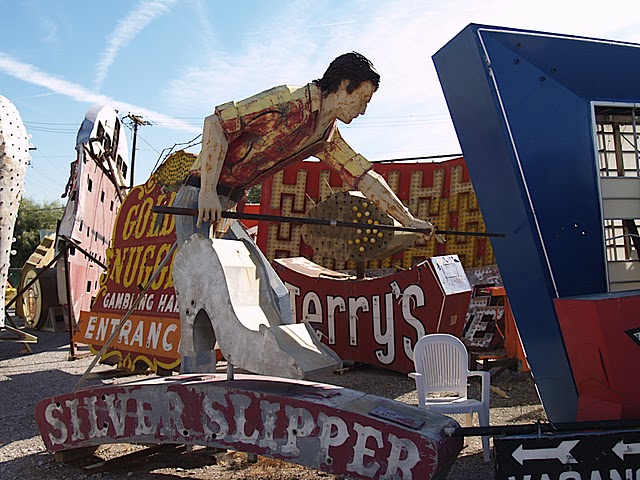
The height and width of the screenshot is (480, 640). In order to click on pool stick in this screenshot , I will do `click(340, 221)`.